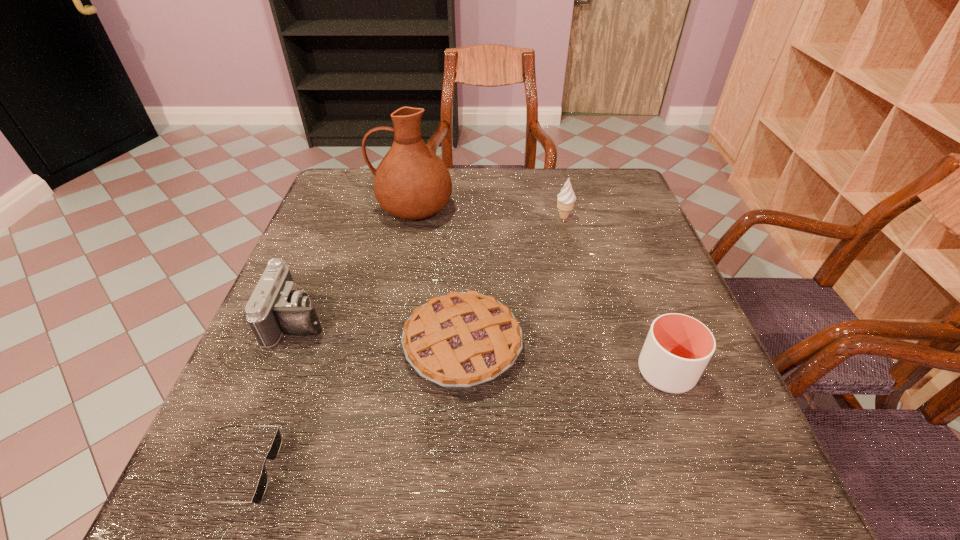
Locate an element on the screen. The height and width of the screenshot is (540, 960). the tallest object is located at coordinates (411, 182).

What are the coordinates of `the second object from right to left` in the screenshot? It's located at (566, 198).

The image size is (960, 540). What are the coordinates of `camera` in the screenshot? It's located at (276, 306).

Image resolution: width=960 pixels, height=540 pixels. I want to click on the rightmost object, so click(x=678, y=347).

Locate an element on the screen. The image size is (960, 540). the fifth tallest object is located at coordinates (462, 339).

Where is `the nearest object`? The height and width of the screenshot is (540, 960). the nearest object is located at coordinates (276, 444).

The height and width of the screenshot is (540, 960). In order to click on the shortest object in this screenshot , I will do `click(276, 444)`.

At what (x,y) coordinates should I click in order to perform the action: click on vacant space positioned on the side of the tallest object with the handle. Please return your answer as a coordinate pair (x, y). Image resolution: width=960 pixels, height=540 pixels. Looking at the image, I should click on point(340,208).

I want to click on vacant space located on the side of the tallest object with the handle, so (329, 208).

I want to click on vacant point located 0.080m on the side of the tallest object with the handle, so click(x=344, y=208).